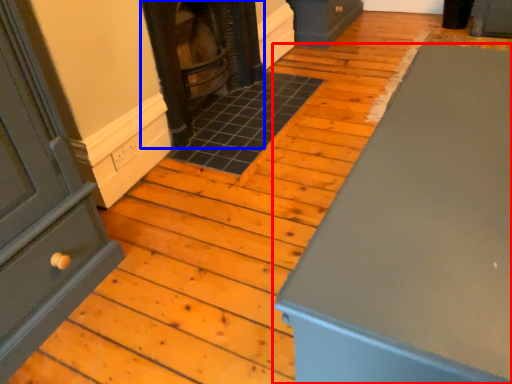
Question: Which of the following is the farthest to the observer, furniture (highlighted by a red box) or stove (highlighted by a blue box)?

Choices:
 (A) furniture
 (B) stove

Answer: (B)